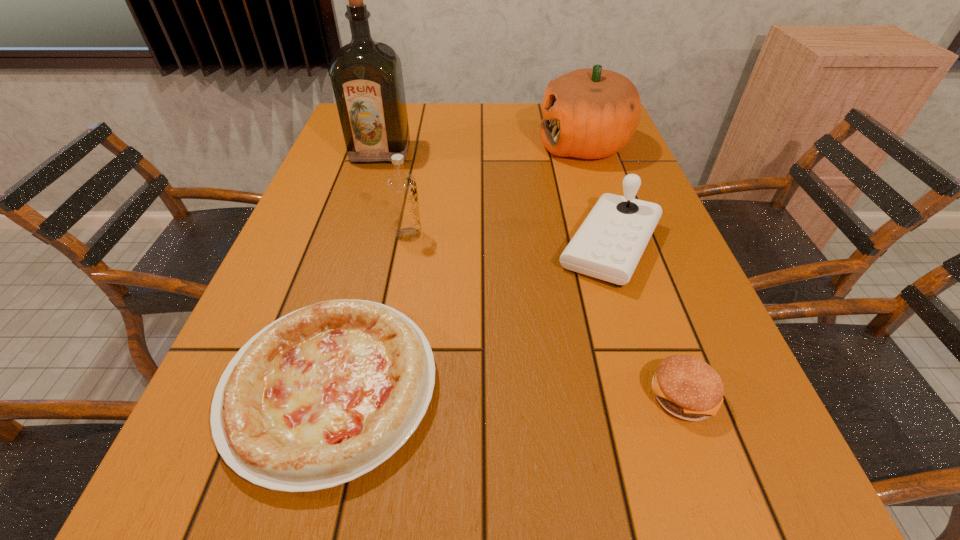
The image size is (960, 540). I want to click on hamburger that is at the right edge, so click(x=687, y=387).

Locate an element on the screen. This screenshot has height=540, width=960. object present at the near left corner is located at coordinates (323, 395).

Locate an element on the screen. object situated at the far right corner is located at coordinates coord(591,113).

Identify the location of vacant space at the near edge of the desktop. [549, 503].

Find the location of a particular element. This screenshot has height=540, width=960. vacant region at the left edge of the desktop is located at coordinates (344, 140).

Where is `vacant area at the right edge of the desktop`? The width and height of the screenshot is (960, 540). vacant area at the right edge of the desktop is located at coordinates (696, 433).

Locate an element on the screen. The image size is (960, 540). free space between the pizza and the pumpkin is located at coordinates (458, 266).

Find the location of a particular element. This screenshot has height=540, width=960. vacant region between the pizza and the pumpkin is located at coordinates (458, 266).

Locate an element on the screen. vacant area that lies between the vodka and the pumpkin is located at coordinates [x=496, y=190].

You are a GUI agent. You are given a task and a screenshot of the screen. Output one action in this format:
    pyautogui.click(x=<x>, y=<y>)
    Task: Click on the empty location between the liquor and the pizza
    This screenshot has width=960, height=540.
    Given the screenshot: What is the action you would take?
    pyautogui.click(x=356, y=269)